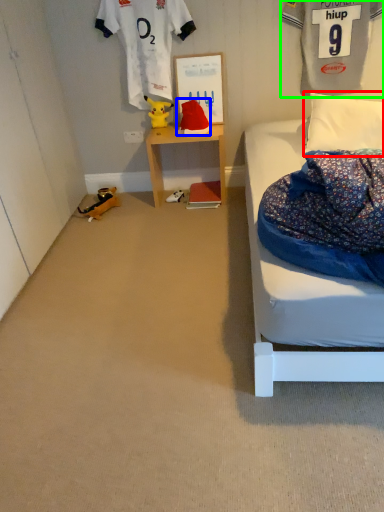
Question: Considering the real-world distances, which object is closest to pillow (highlighted by a red box)? toy (highlighted by a blue box) or clothing (highlighted by a green box).

Choices:
 (A) toy
 (B) clothing

Answer: (B)